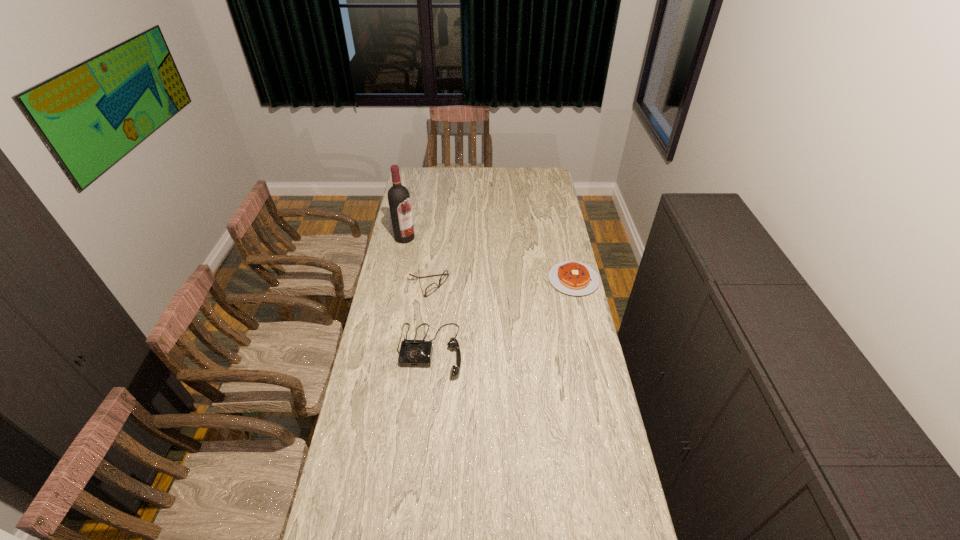
Locate an element on the screen. The width and height of the screenshot is (960, 540). vacant spot on the desktop that is between the second tallest object and the pancake and is positioned on the front-facing side of the spectacles is located at coordinates (496, 318).

At what (x,y) coordinates should I click in order to perform the action: click on vacant space on the desktop that is between the telephone and the pancake and is positioned on the label of the wine bottle. Please return your answer as a coordinate pair (x, y). The image size is (960, 540). Looking at the image, I should click on (490, 321).